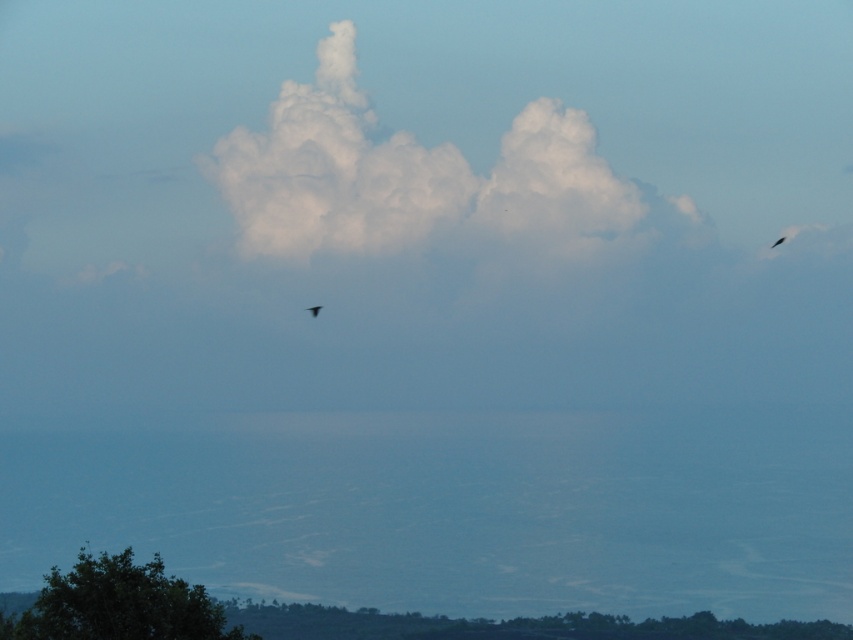
Which is behind, point (512, 196) or point (782, 241)?

The point (782, 241) is behind.

Does white fluffy cloud at center have a smaller size compared to black feathered bird at upper center?

No, white fluffy cloud at center is not smaller than black feathered bird at upper center.

Is point (519, 221) farther from viewer compared to point (781, 237)?

No, it is in front of (781, 237).

Identify the location of white fluffy cloud at center. (419, 180).

Does point (184, 596) come closer to viewer compared to point (779, 237)?

That is True.

Can you confirm if green leafy tree at lower left is shorter than black feathered bird at upper center?

In fact, green leafy tree at lower left may be taller than black feathered bird at upper center.

Who is more forward, (30, 628) or (773, 244)?

Positioned in front is point (30, 628).

Find the location of a particular element. green leafy tree at lower left is located at coordinates (119, 604).

Between point (317, 307) and point (782, 237), which one is positioned in front?

Point (317, 307) is in front.

Looking at this image, can you confirm if silvery metallic bird at center is thinner than black feathered bird at upper center?

Yes.

Find the location of a particular element. silvery metallic bird at center is located at coordinates click(x=312, y=310).